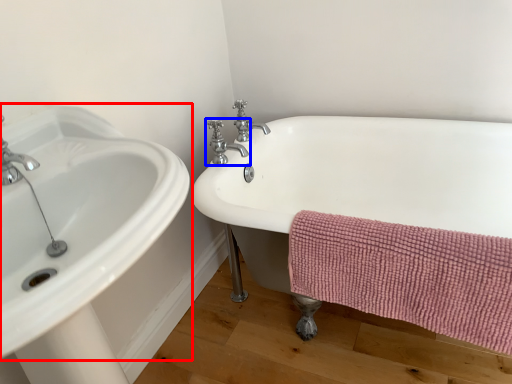
Question: Which object appears closest to the camera in this image, sink (highlighted by a red box) or tap (highlighted by a blue box)?

Choices:
 (A) sink
 (B) tap

Answer: (A)